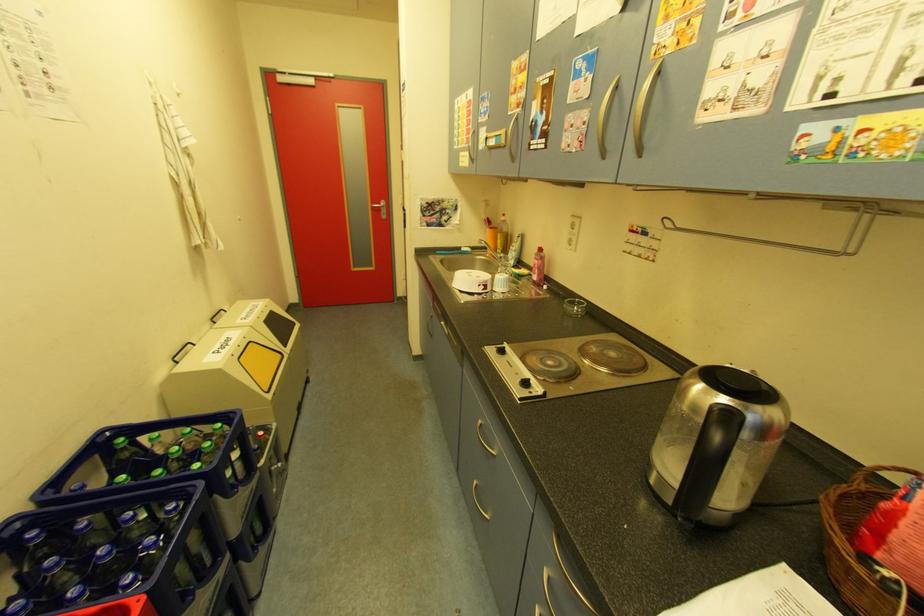
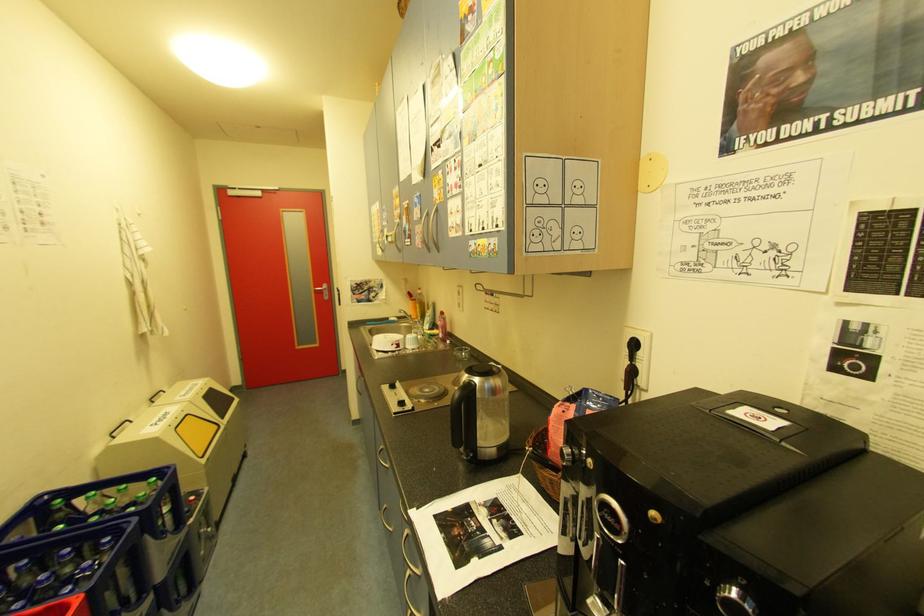
What movement of the cameraman would produce the second image?

The cameraman walked toward right, backward.